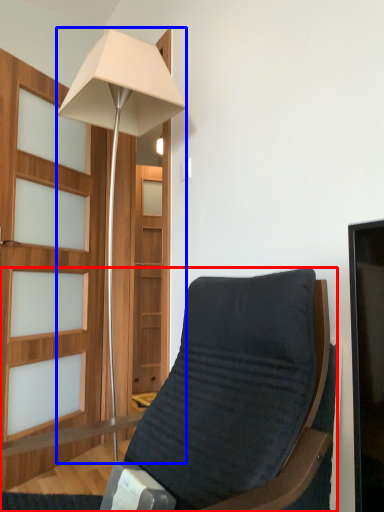
Question: Which of the following is the closest to the observer, chair (highlighted by a red box) or lamp (highlighted by a blue box)?

Choices:
 (A) chair
 (B) lamp

Answer: (A)